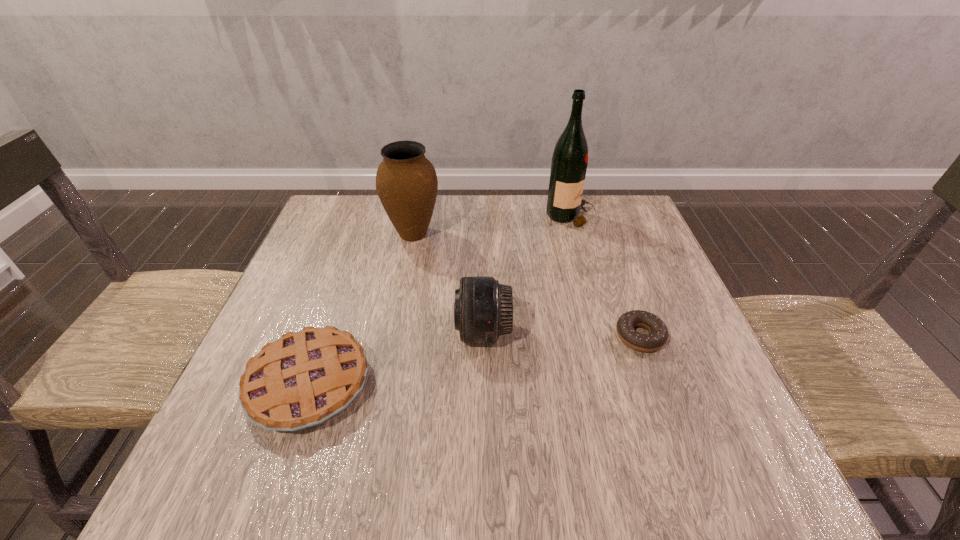
Find the location of a particular element. The width and height of the screenshot is (960, 540). free location located on the front-facing side of the third object from left to right is located at coordinates click(307, 332).

Locate an element on the screen. Image resolution: width=960 pixels, height=540 pixels. free space located on the back of the pie is located at coordinates (338, 301).

Locate an element on the screen. vacant space located 0.400m on the back of the shortest object is located at coordinates (596, 216).

Where is `wine bottle positioned at the far edge`? This screenshot has width=960, height=540. wine bottle positioned at the far edge is located at coordinates (569, 163).

You are a GUI agent. You are given a task and a screenshot of the screen. Output one action in this format:
    pyautogui.click(x=<x>, y=<y>)
    Task: Click on the urn positioned at the far edge
    
    Given the screenshot: What is the action you would take?
    pyautogui.click(x=406, y=181)

At what (x,y) coordinates should I click in order to perform the action: click on object situated at the near edge. Please return your answer as a coordinate pair (x, y). Looking at the image, I should click on (305, 378).

What are the coordinates of `object that is at the left edge` in the screenshot? It's located at (305, 378).

The image size is (960, 540). What are the coordinates of `wine bottle that is at the right edge` in the screenshot? It's located at (569, 163).

At what (x,y) coordinates should I click in order to perform the action: click on doughnut present at the right edge. Please return your answer as a coordinate pair (x, y). This screenshot has height=540, width=960. Looking at the image, I should click on (658, 336).

Where is `object present at the near left corner`? The width and height of the screenshot is (960, 540). object present at the near left corner is located at coordinates point(305,378).